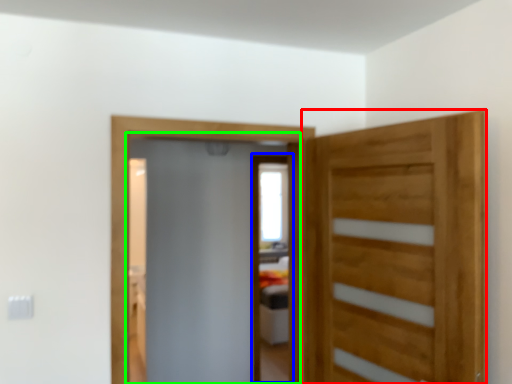
Question: Which is farther away from door (highlighted by a red box)? screen door (highlighted by a blue box) or screen door (highlighted by a green box)?

Choices:
 (A) screen door
 (B) screen door

Answer: (A)